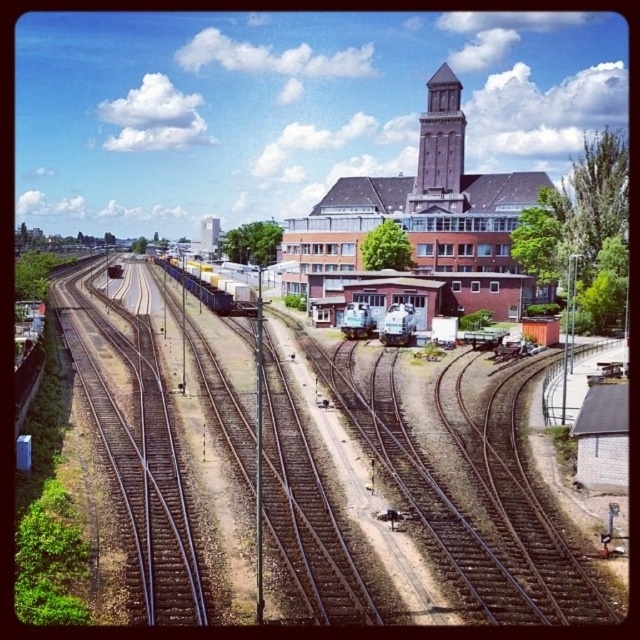
Question: Which object is the farthest from the brick bell tower at center?

Choices:
 (A) brown metal tracks at center
 (B) yellow matte train carriages at center
 (C) green metallic train at center

Answer: (A)

Question: Where is brown brick bell tower at upper center located in relation to brick bell tower at center in the image?

Choices:
 (A) below
 (B) above

Answer: (A)

Question: Which point appears farthest from the camera in this image?

Choices:
 (A) 438,83
 (B) 205,230
 (C) 394,308

Answer: (B)

Question: Does brown metal tracks at center have a smaller size compared to brown brick bell tower at upper center?

Choices:
 (A) yes
 (B) no

Answer: (B)

Question: Which of these objects is positioned farthest from the brown metal tracks at center?

Choices:
 (A) brown brick bell tower at upper center
 (B) yellow matte train carriages at center
 (C) brick bell tower at center

Answer: (C)

Question: Can you confirm if green metallic train at center is positioned to the left of brick bell tower at center?

Choices:
 (A) no
 (B) yes

Answer: (A)